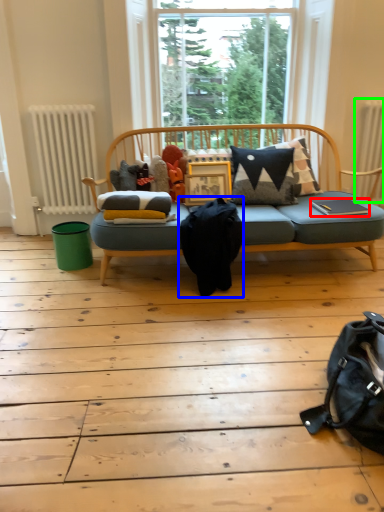
Question: Which is farther away from book (highlighted by a red box)? messenger bag (highlighted by a blue box) or radiator (highlighted by a green box)?

Choices:
 (A) messenger bag
 (B) radiator

Answer: (A)